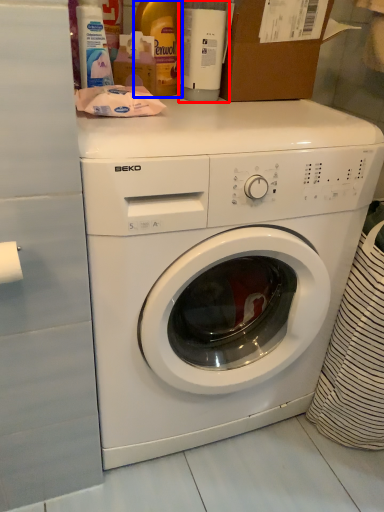
Question: Which object is closer to the camera taking this photo, bottle (highlighted by a red box) or bottle (highlighted by a blue box)?

Choices:
 (A) bottle
 (B) bottle

Answer: (A)